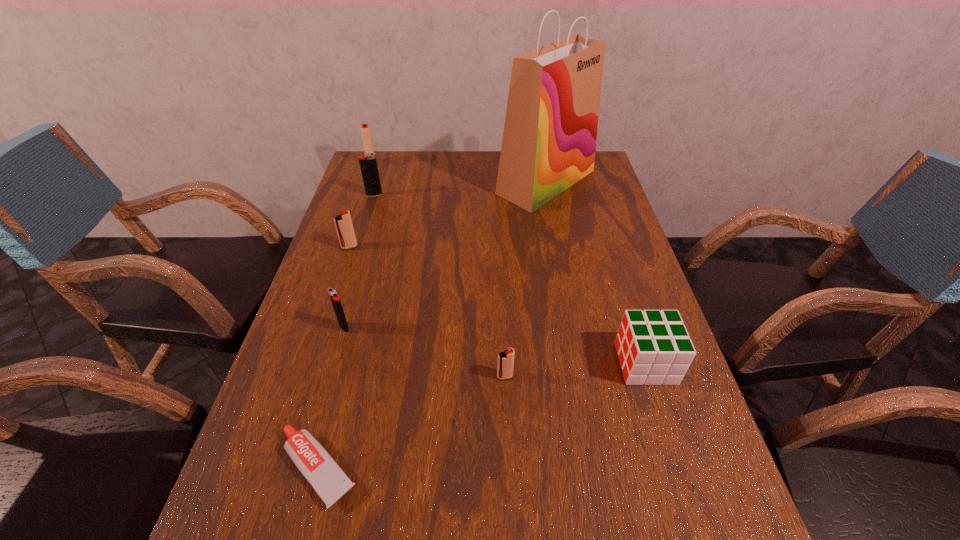
Where is `object that stands as the second closest to the fifth nearest object`? object that stands as the second closest to the fifth nearest object is located at coordinates (338, 309).

The height and width of the screenshot is (540, 960). What are the coordinates of `the third closest object to the farthest igniter` in the screenshot? It's located at (549, 141).

Select which igniter is the fourth closest to the shopping bag. Please provide its 2D coordinates. Your answer should be formatted as a tuple, i.e. [(x, y)], where the tuple contains the x and y coordinates of a point satisfying the conditions above.

[(338, 309)]

Locate an element on the screen. The height and width of the screenshot is (540, 960). the closest igniter to the tallest object is located at coordinates (368, 164).

Find the location of a particular element. red igniter that stands as the closest to the shopping bag is located at coordinates (365, 129).

Identify which red igniter is the second closest to the second farthest igniter. Please provide its 2D coordinates. Your answer should be formatted as a tuple, i.e. [(x, y)], where the tuple contains the x and y coordinates of a point satisfying the conditions above.

[(343, 223)]

Identify which black igniter is located as the second nearest to the nearest red igniter. Please provide its 2D coordinates. Your answer should be formatted as a tuple, i.e. [(x, y)], where the tuple contains the x and y coordinates of a point satisfying the conditions above.

[(368, 164)]

Locate an element on the screen. vacant space that satisfies the following two spatial constraints: 1. on the front side of the farthest igniter; 2. on the right side of the fourth farthest igniter is located at coordinates (315, 327).